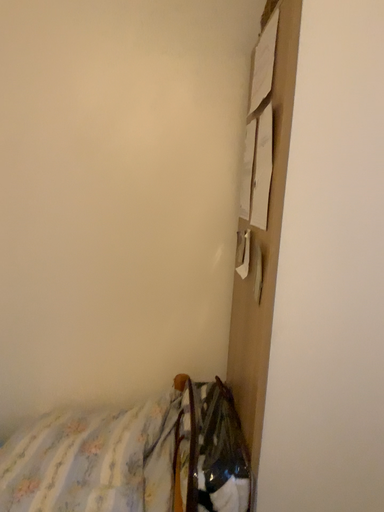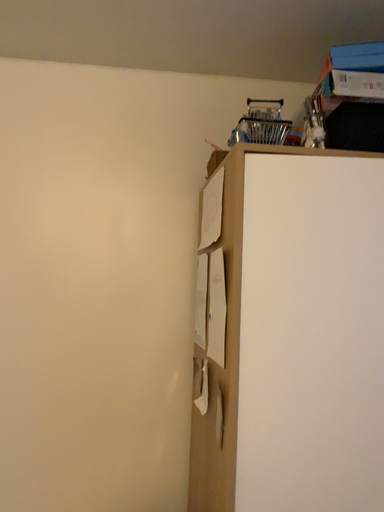
Question: How did the camera likely rotate when shooting the video?

Choices:
 (A) rotated downward
 (B) rotated upward

Answer: (B)